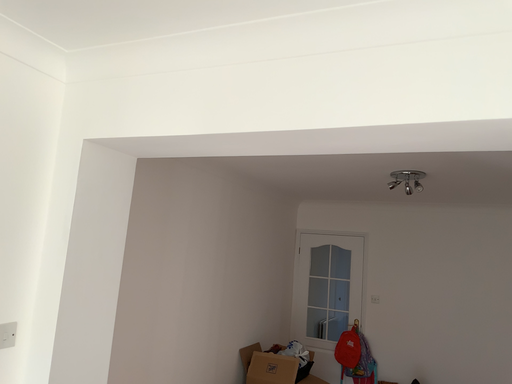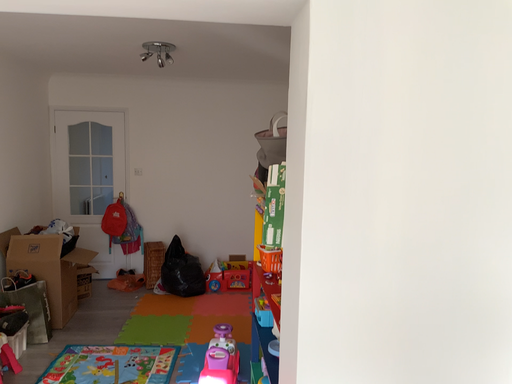
Question: Which way did the camera rotate in the video?

Choices:
 (A) rotated left
 (B) rotated right

Answer: (B)